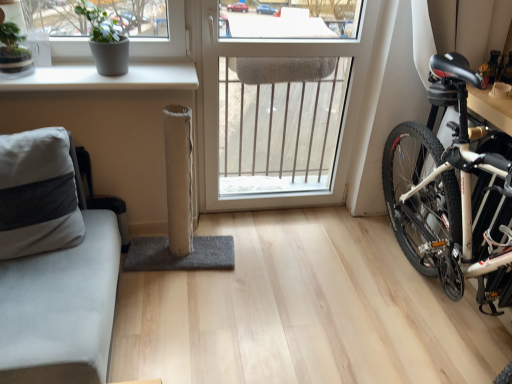
Find the location of a particular element. empty space that is ontop of white matte window sill at upper left (from a real-world perspective) is located at coordinates (70, 77).